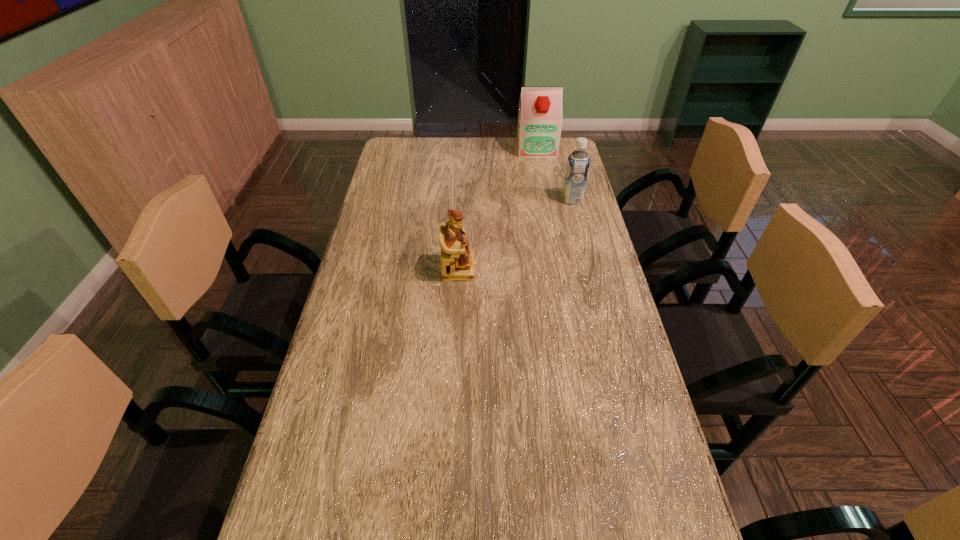
At what (x,y) coordinates should I click in order to perform the action: click on vacant space that satisfies the following two spatial constraints: 1. with the cap open on the farthest object; 2. on the front-facing side of the figurine. Please return your answer as a coordinate pair (x, y). Looking at the image, I should click on (558, 268).